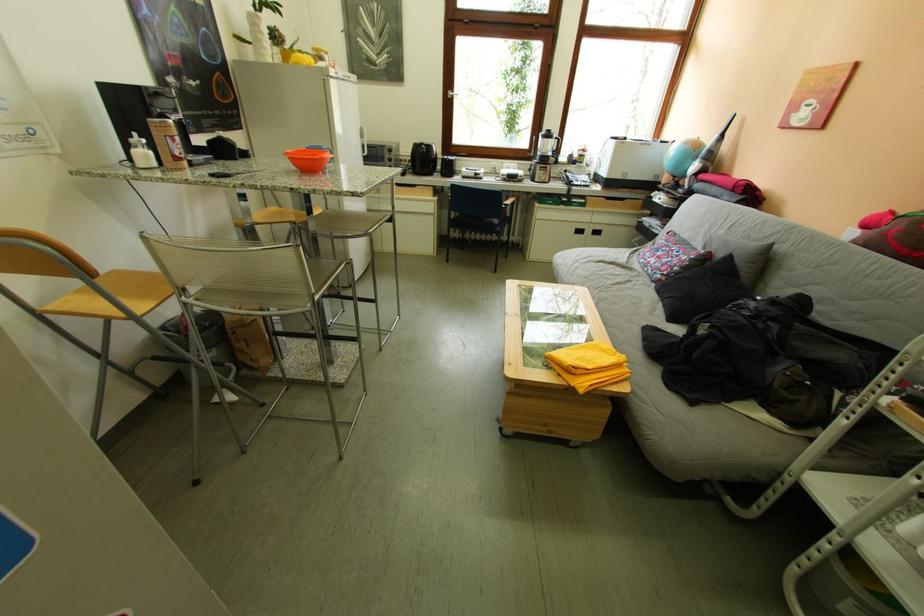
At what (x,y) coordinates should I click in order to perform the action: click on blue globe. Please return your answer as a coordinate pair (x, y). Looking at the image, I should click on 681,158.